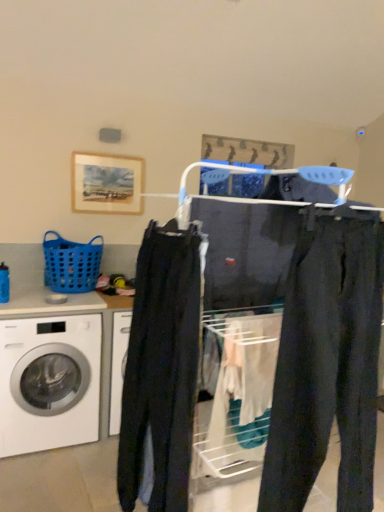
Question: In terms of size, does white glossy washing machine at lower left appear bigger or smaller than dark gray cotton pants at center?

Choices:
 (A) small
 (B) big

Answer: (B)

Question: From their relative heights in the image, would you say white glossy washing machine at lower left is taller or shorter than dark gray cotton pants at center?

Choices:
 (A) short
 (B) tall

Answer: (A)

Question: Estimate the real-world distances between objects in this image. Which object is closer to the white glossy washing machine at lower left?

Choices:
 (A) wooden frame at upper left
 (B) dark gray cotton pants at center
 (C) dark blue jeans at center
 (D) blue plastic basket at left
 (E) dark blue jeans at center

Answer: (D)

Question: Which object is positioned farthest from the dark gray cotton pants at center?

Choices:
 (A) blue plastic basket at left
 (B) dark blue jeans at center
 (C) dark blue jeans at center
 (D) wooden frame at upper left
 (E) white glossy washing machine at lower left

Answer: (D)